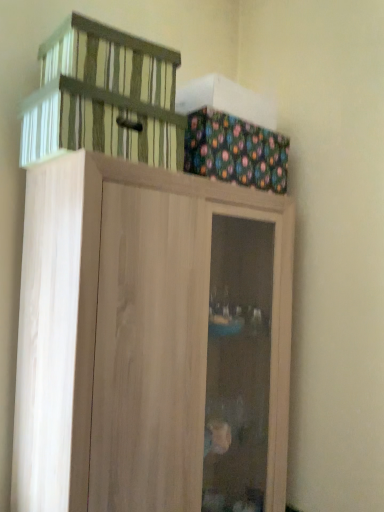
Question: Considering the relative positions of light wood cupboard at upper center and multicolored fabric box at upper right in the image provided, is light wood cupboard at upper center in front of multicolored fabric box at upper right?

Choices:
 (A) no
 (B) yes

Answer: (B)

Question: Does light wood cupboard at upper center touch multicolored fabric box at upper right?

Choices:
 (A) yes
 (B) no

Answer: (B)

Question: From the image's perspective, is light wood cupboard at upper center below multicolored fabric box at upper right?

Choices:
 (A) yes
 (B) no

Answer: (A)

Question: Considering the relative positions of light wood cupboard at upper center and multicolored fabric box at upper right in the image provided, is light wood cupboard at upper center to the left of multicolored fabric box at upper right from the viewer's perspective?

Choices:
 (A) yes
 (B) no

Answer: (A)

Question: Is light wood cupboard at upper center to the right of multicolored fabric box at upper right from the viewer's perspective?

Choices:
 (A) yes
 (B) no

Answer: (B)

Question: From a real-world perspective, is light wood cupboard at upper center physically above multicolored fabric box at upper right?

Choices:
 (A) yes
 (B) no

Answer: (B)

Question: From a real-world perspective, is striped fabric basket at upper left positioned over multicolored fabric box at upper right based on gravity?

Choices:
 (A) no
 (B) yes

Answer: (B)

Question: Does striped fabric basket at upper left come in front of multicolored fabric box at upper right?

Choices:
 (A) no
 (B) yes

Answer: (B)

Question: Is striped fabric basket at upper left facing away from multicolored fabric box at upper right?

Choices:
 (A) yes
 (B) no

Answer: (B)

Question: Is striped fabric basket at upper left aimed at multicolored fabric box at upper right?

Choices:
 (A) yes
 (B) no

Answer: (B)

Question: Does striped fabric basket at upper left have a lesser height compared to multicolored fabric box at upper right?

Choices:
 (A) no
 (B) yes

Answer: (B)

Question: Can you confirm if striped fabric basket at upper left is smaller than multicolored fabric box at upper right?

Choices:
 (A) no
 (B) yes

Answer: (B)

Question: Is striped fabric basket at upper left outside of light wood cupboard at upper center?

Choices:
 (A) yes
 (B) no

Answer: (A)